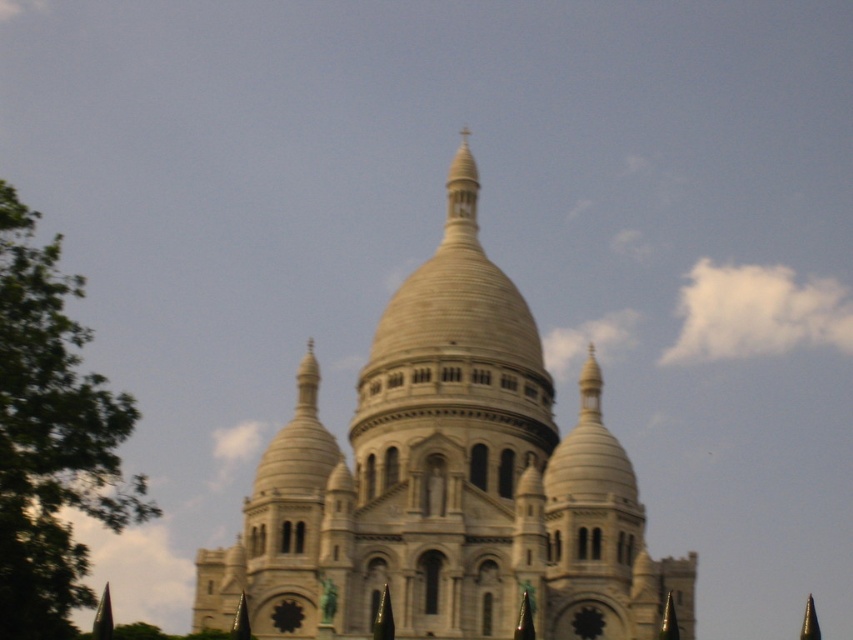
You are a tourist standing in front of the white stone church at center and the green leafy tree at left. Which object appears taller from your viewpoint?

The white stone church at center appears taller than the green leafy tree at left because it has a greater height compared to the green leafy tree at left.

From the picture: You are a tourist standing at the base of the white stone church at center and want to take a photo that includes both the church and the green leafy tree at left. Since you have a wide angle lens, will you be able to fit both in the frame without moving closer or farther away?

The white stone church at center is larger in size than the green leafy tree at left, so you will need to step back to include both in the frame. However, since you mentioned using a wide angle lens which captures a broader perspective, it might be possible to fit both without moving, but the church will appear proportionally larger in the photo.

Consider the image. You are standing at the base of the Sacre Coeur Basilica in Paris. You want to take a photo of the point at coordinate (642, 547) on the building. If your camera has a maximum focus range of 100 meters, will you be able to focus on that point?

The distance of point (642, 547) from camera is 107.72 meters, which is beyond the camera maximum focus range of 100 meters. Therefore, you won not be able to focus on that point.